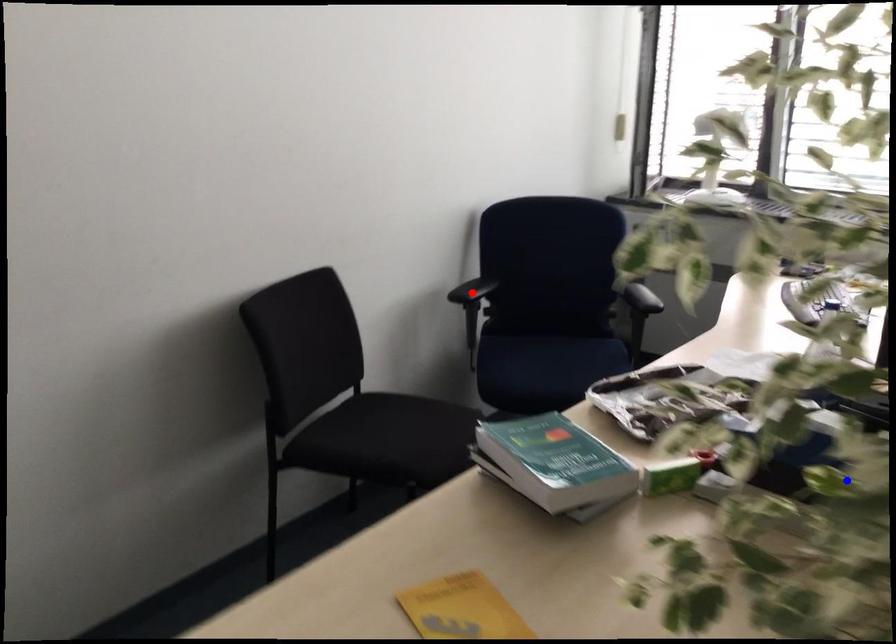
Question: In the image, two points are highlighted. Which point is nearer to the camera? Reply with the corresponding letter.

Choices:
 (A) blue point
 (B) red point

Answer: (A)